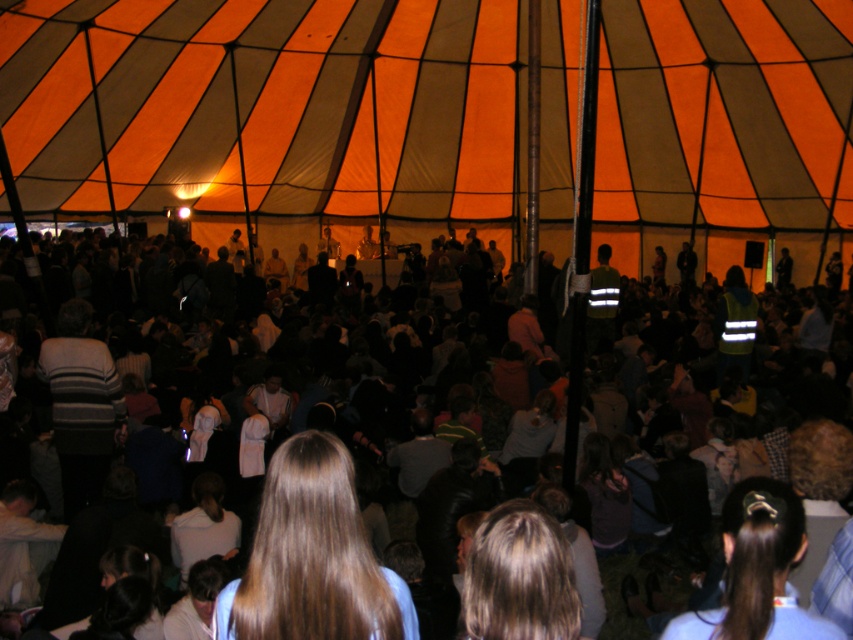
You are standing at the point labeled point (811,131) in the tent. If you want to move to the stage area at the back, which is 25.30 meters away, can you walk directly there without moving around any obstacles?

The distance between you and the stage area at the back is 25.30 meters. Since there are no obstacles mentioned in the scene description, you can walk directly to the stage area at the back.

You are standing inside the tent and want to move from point (384, 380) to point (354, 532). Since both points are marked on the floor, will you be moving towards the front or the back of the tent?

Moving from point (384, 380) to point (354, 532) means moving towards the back of the tent because point (384, 380) is closer to the viewer than point (354, 532). Since the stage is at the back, moving away from the viewer direction would be towards the back.

You are an event planner standing at the entrance of the orange striped tent at center and you see the brown hair at center. Which object is located to the left of the other?

The orange striped tent at center is positioned on the right side of brown hair at center, so the brown hair at center is located to the left of the orange striped tent at center.